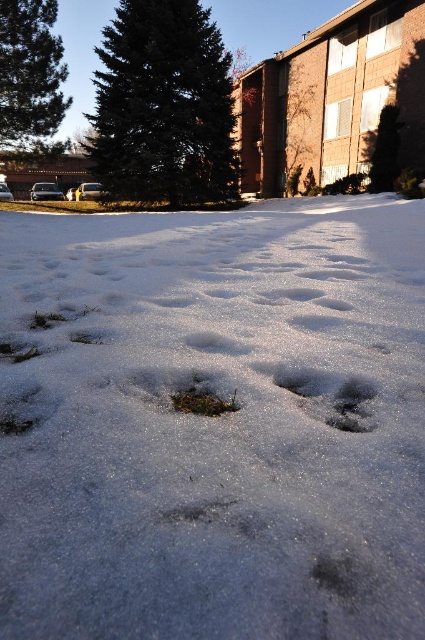
Is green matte pine at upper left shorter than white fluffy footprint at center?

No.

Is green matte pine at upper left above white fluffy footprint at center?

Indeed, green matte pine at upper left is positioned over white fluffy footprint at center.

Which is in front, point (54, 3) or point (342, 300)?

Positioned in front is point (342, 300).

Locate an element on the screen. This screenshot has width=425, height=640. green matte pine at upper left is located at coordinates coord(31,77).

Who is lower down, green grass at center or white fluffy footprint at center?

green grass at center

Is green grass at center above white fluffy footprint at center?

Incorrect, green grass at center is not positioned above white fluffy footprint at center.

Is point (215, 397) behind point (334, 308)?

No, (215, 397) is closer to viewer.

Find the location of a particular element. Image resolution: width=425 pixels, height=640 pixels. green grass at center is located at coordinates (203, 403).

Is white fluffy snow at center to the right of green needle-like pine at upper left from the viewer's perspective?

Yes, white fluffy snow at center is to the right of green needle-like pine at upper left.

Is white fluffy snow at center wider than green needle-like pine at upper left?

No, white fluffy snow at center is not wider than green needle-like pine at upper left.

What do you see at coordinates (214, 422) in the screenshot? Image resolution: width=425 pixels, height=640 pixels. I see `white fluffy snow at center` at bounding box center [214, 422].

Locate an element on the screen. white fluffy snow at center is located at coordinates (214, 422).